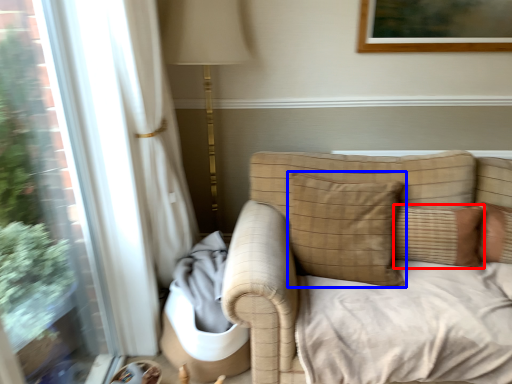
Question: Which object is further to the camera taking this photo, pillow (highlighted by a red box) or pillow (highlighted by a blue box)?

Choices:
 (A) pillow
 (B) pillow

Answer: (A)